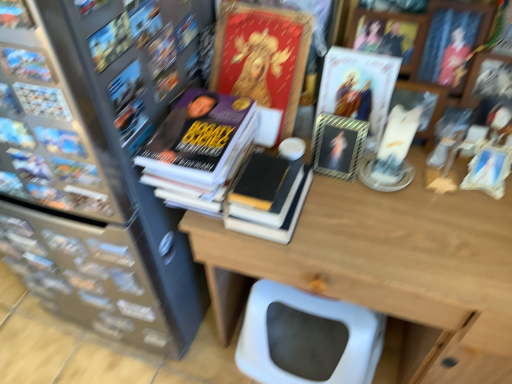
The width and height of the screenshot is (512, 384). In order to click on free space in front of metallic gold frame at upper center, the 1th book cover when ordered from right to left in this screenshot , I will do `click(372, 205)`.